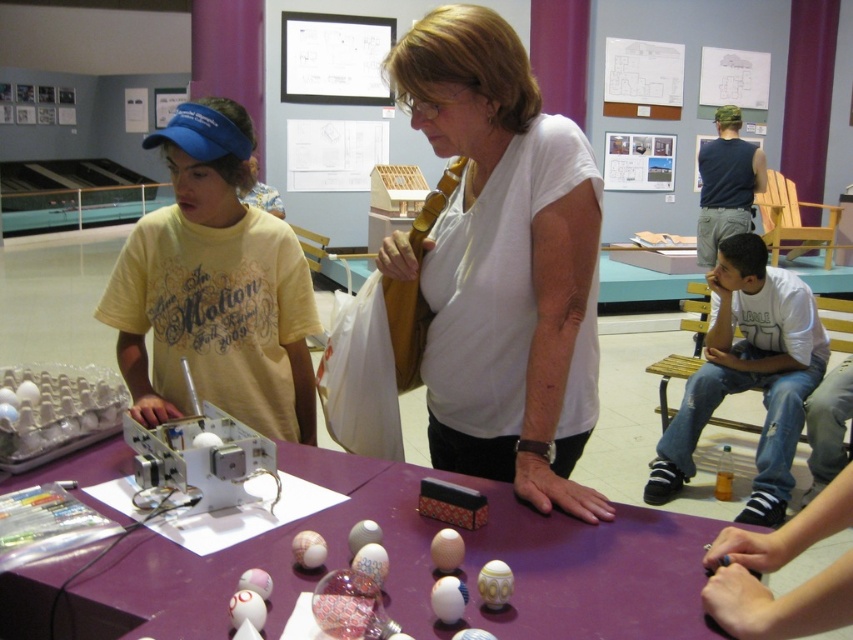
You are a participant at the event and want to place a small object on the purple matte table at center. However, the white matte shirt at center is in the way. Can you move the object around the shirt to reach the table?

The purple matte table at center is behind the white matte shirt at center, so you can move the object around the shirt to reach the table since the table is positioned behind it.

You are a participant in the workshop and need to choose a shirt to wear. The white matte shirt at center is available in size large, and the yellow cotton shirt at left is available in size small. If you usually wear a medium, which shirt should you choose?

The white matte shirt at center is bigger than the yellow cotton shirt at left. Since you usually wear a medium, the white matte shirt at center in size large would be a better fit as it is larger and more accommodating than the small size yellow cotton shirt at left.